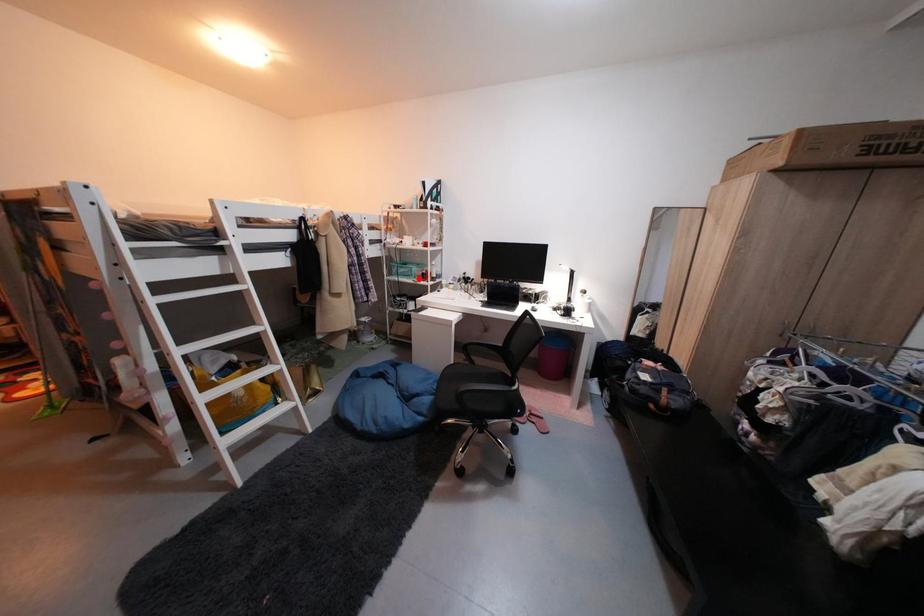
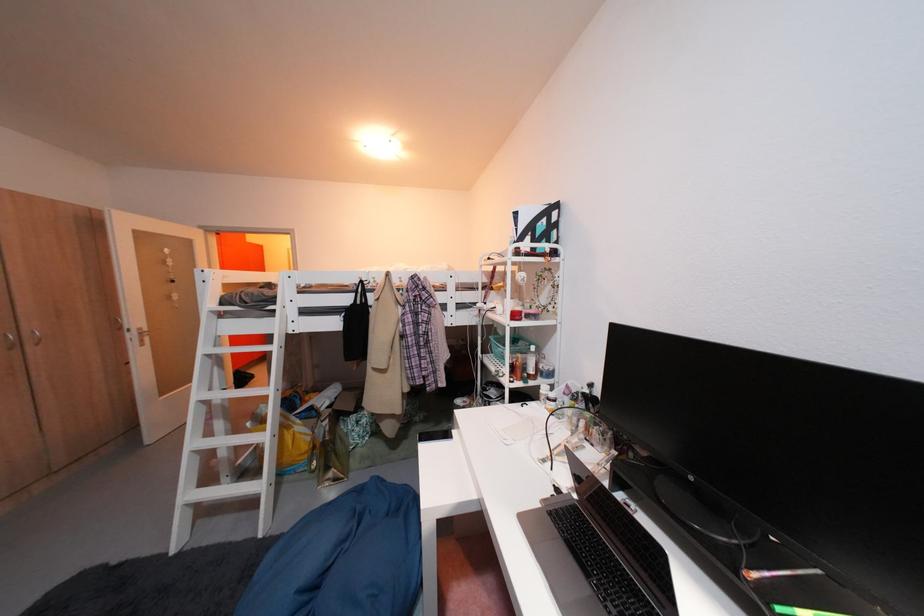
Question: I am providing you with two images of the same scene from different viewpoints. In image1, a red point is highlighted. Considering the same 3D point in image2, which of the following is correct?

Choices:
 (A) It is closer
 (B) It is farther

Answer: (B)